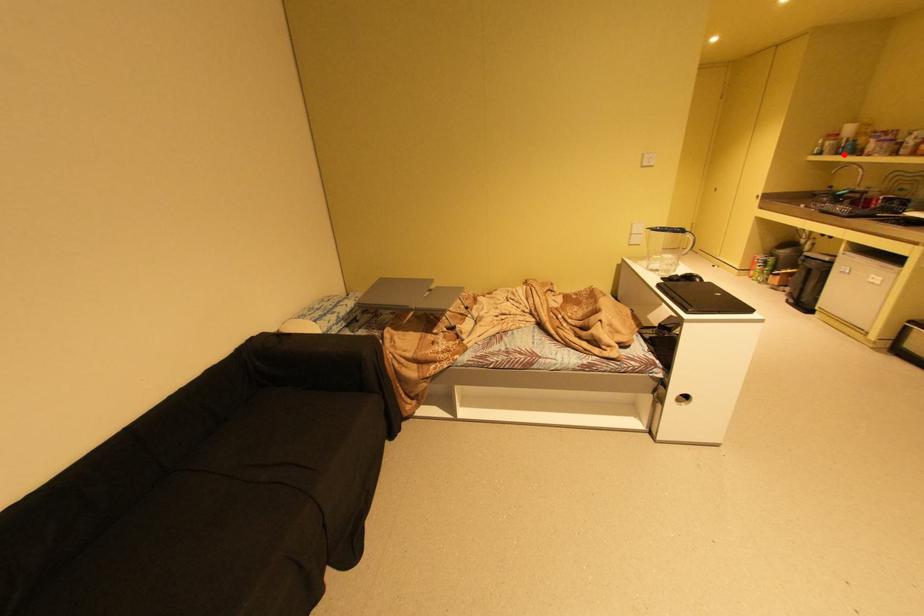
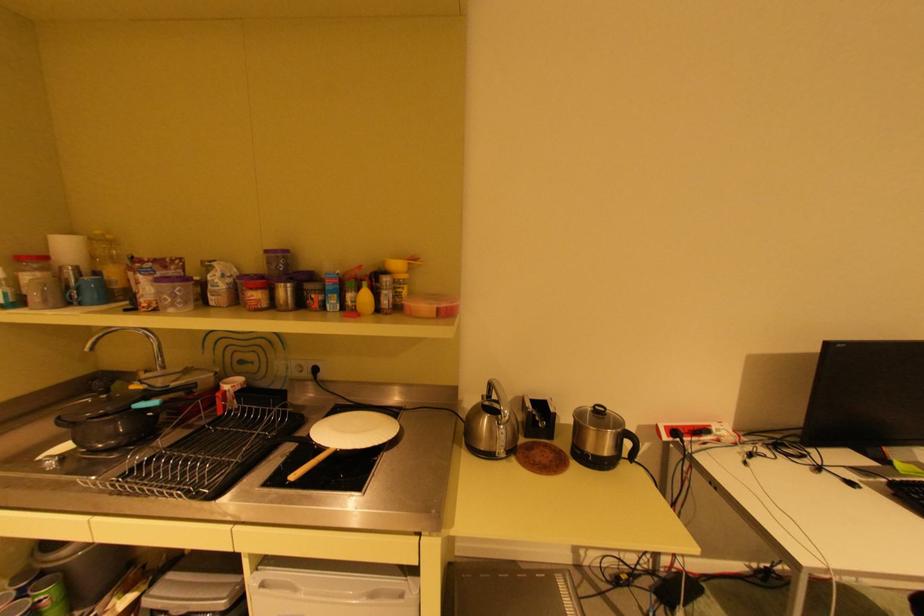
Question: I am providing you with two images of the same scene from different viewpoints. Image1 has a red point marked. In image2, the corresponding 3D location appears at what relative position? Reply with the corresponding letter.

Choices:
 (A) Closer
 (B) Farther

Answer: (A)